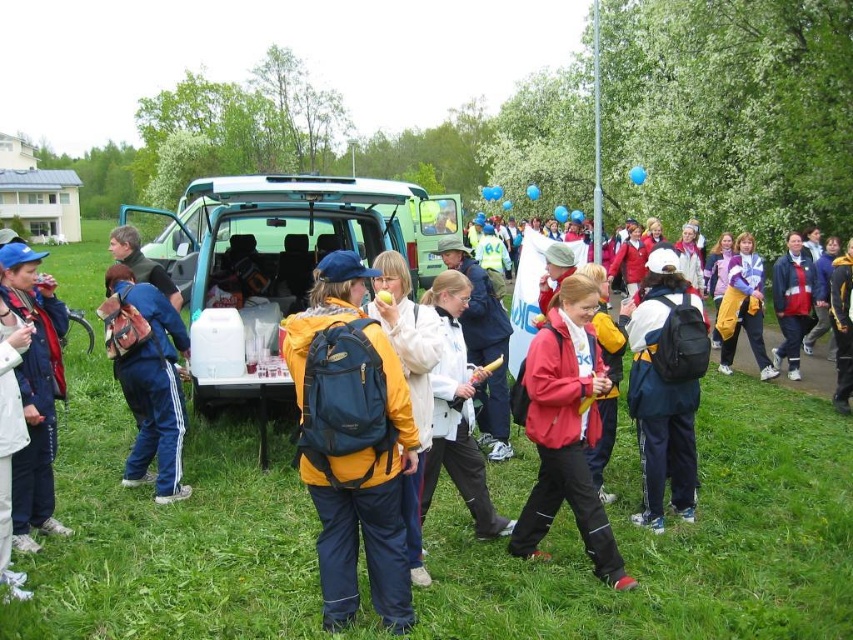
Question: Observing the image, what is the correct spatial positioning of blue synthetic backpack at center in reference to green matte van at center?

Choices:
 (A) right
 (B) left

Answer: (A)

Question: Does matte red jacket at center have a lesser width compared to white matte jacket at left?

Choices:
 (A) no
 (B) yes

Answer: (A)

Question: Which of these objects is positioned closest to the matte blue backpack at center?

Choices:
 (A) matte red jacket at center
 (B) yellow fabric jacket at center

Answer: (A)

Question: Which point is farther to the camera?

Choices:
 (A) (358, 324)
 (B) (404, 499)

Answer: (B)

Question: Is blue synthetic backpack at center to the left of green matte van at center from the viewer's perspective?

Choices:
 (A) yes
 (B) no

Answer: (B)

Question: Among these objects, which one is nearest to the camera?

Choices:
 (A) matte blue backpack at center
 (B) yellow matte backpack at center
 (C) white matte jacket at left

Answer: (A)